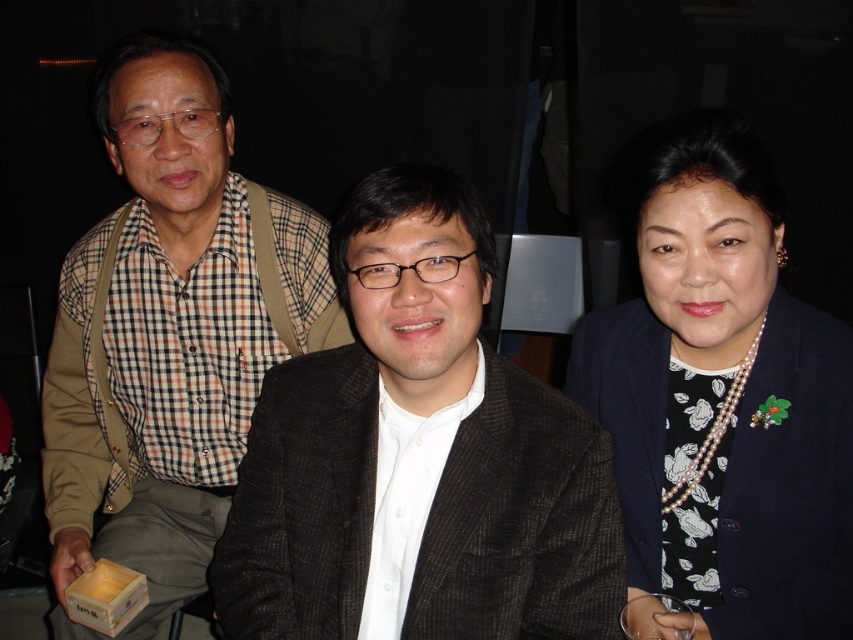
Is dark brown textured blazer at center to the left of pearl necklace at right from the viewer's perspective?

Yes, dark brown textured blazer at center is to the left of pearl necklace at right.

Does dark brown textured blazer at center have a greater width compared to pearl necklace at right?

Indeed, dark brown textured blazer at center has a greater width compared to pearl necklace at right.

Does point (254, 538) come behind point (740, 388)?

Yes.

Locate an element on the screen. dark brown textured blazer at center is located at coordinates (419, 452).

Is navy blue blazer at center smaller than brown checkered shirt at left?

Correct, navy blue blazer at center occupies less space than brown checkered shirt at left.

Can you confirm if navy blue blazer at center is thinner than brown checkered shirt at left?

Yes, navy blue blazer at center is thinner than brown checkered shirt at left.

Does point (685, 576) come farther from viewer compared to point (144, 154)?

No.

Locate an element on the screen. This screenshot has height=640, width=853. navy blue blazer at center is located at coordinates (722, 394).

Can you confirm if navy blue blazer at center is smaller than pearl necklace at right?

Incorrect, navy blue blazer at center is not smaller in size than pearl necklace at right.

Is navy blue blazer at center positioned at the back of pearl necklace at right?

No, navy blue blazer at center is in front of pearl necklace at right.

At what (x,y) coordinates should I click in order to perform the action: click on navy blue blazer at center. Please return your answer as a coordinate pair (x, y). The image size is (853, 640). Looking at the image, I should click on pyautogui.click(x=722, y=394).

Find the location of a particular element. The image size is (853, 640). navy blue blazer at center is located at coordinates (722, 394).